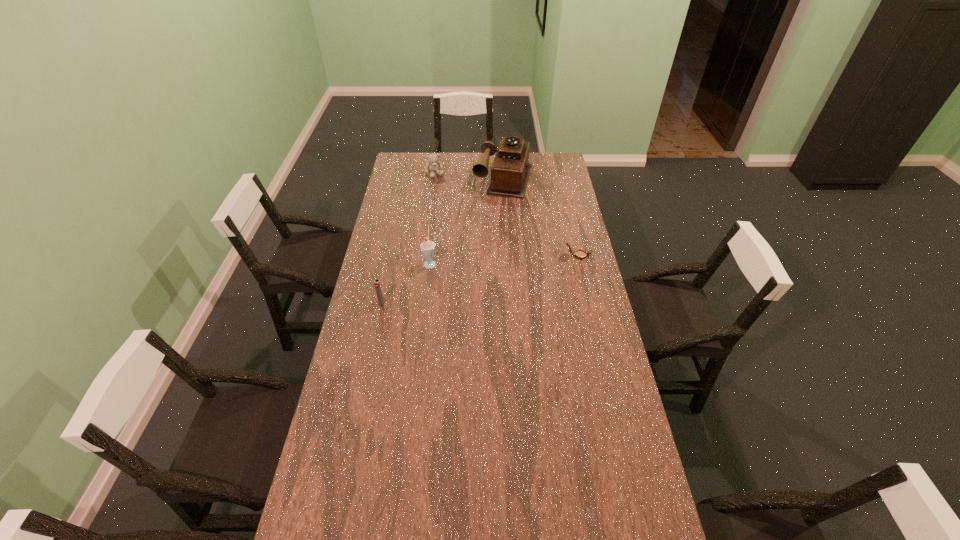
I want to click on empty location between the teddy bear and the compass, so click(506, 214).

Where is `free point between the phonograph_record and the milkshake`? This screenshot has width=960, height=540. free point between the phonograph_record and the milkshake is located at coordinates (467, 220).

Identify the location of vacant area that lies between the nearest object and the fourth shortest object. This screenshot has height=540, width=960. (406, 283).

Identify the location of vacant area between the tallest object and the shortest object. (540, 217).

At what (x,y) coordinates should I click in order to perform the action: click on empty space between the leftmost object and the shortest object. Please return your answer as a coordinate pair (x, y). The width and height of the screenshot is (960, 540). Looking at the image, I should click on (480, 280).

The image size is (960, 540). What are the coordinates of `object that is the third closest to the rightmost object` in the screenshot? It's located at (377, 285).

Where is `object identified as the closest to the teddy bear`? This screenshot has height=540, width=960. object identified as the closest to the teddy bear is located at coordinates (510, 171).

The image size is (960, 540). Find the location of `vacant region that satisfies the following two spatial constraints: 1. on the back side of the shortest object; 2. on the face of the second tallest object`. vacant region that satisfies the following two spatial constraints: 1. on the back side of the shortest object; 2. on the face of the second tallest object is located at coordinates (431, 255).

The height and width of the screenshot is (540, 960). I want to click on vacant space that satisfies the following two spatial constraints: 1. on the back side of the igniter; 2. on the right side of the teddy bear, so click(409, 174).